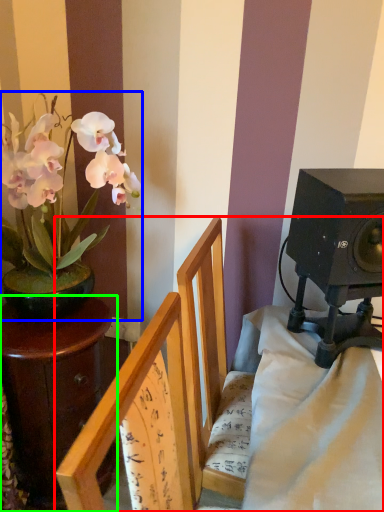
Question: Which object is positioned closest to furniture (highlighted by a red box)? Select from houseplant (highlighted by a blue box) and table (highlighted by a green box).

Choices:
 (A) houseplant
 (B) table

Answer: (B)